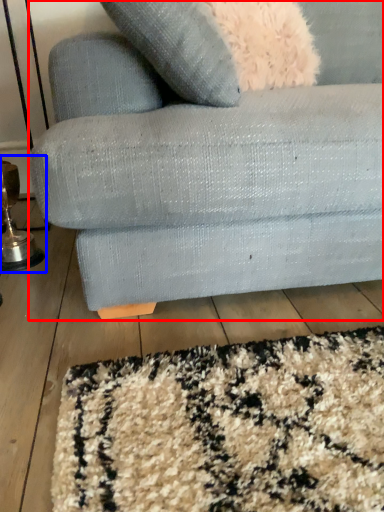
Question: Which object is closer to the camera taking this photo, studio couch (highlighted by a red box) or table lamp (highlighted by a blue box)?

Choices:
 (A) studio couch
 (B) table lamp

Answer: (A)